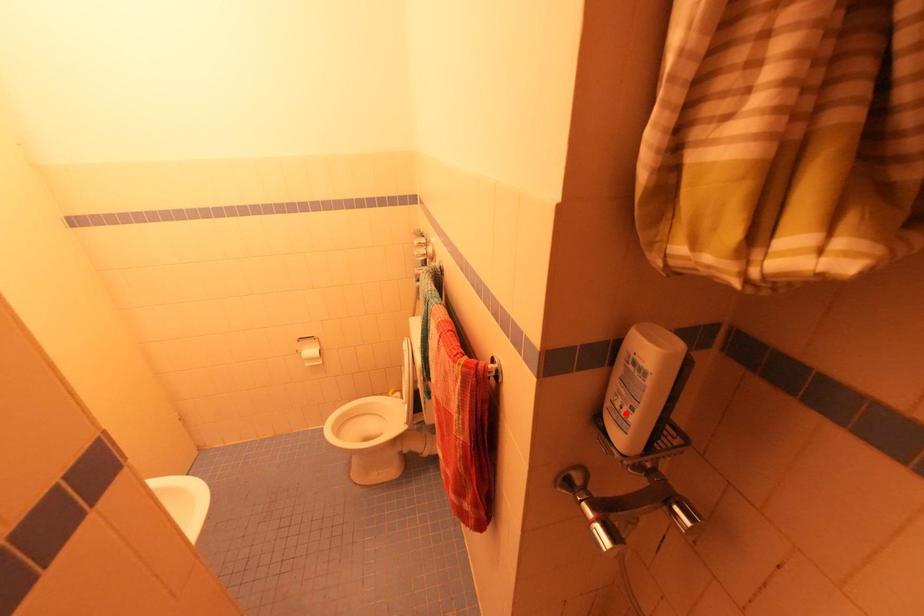
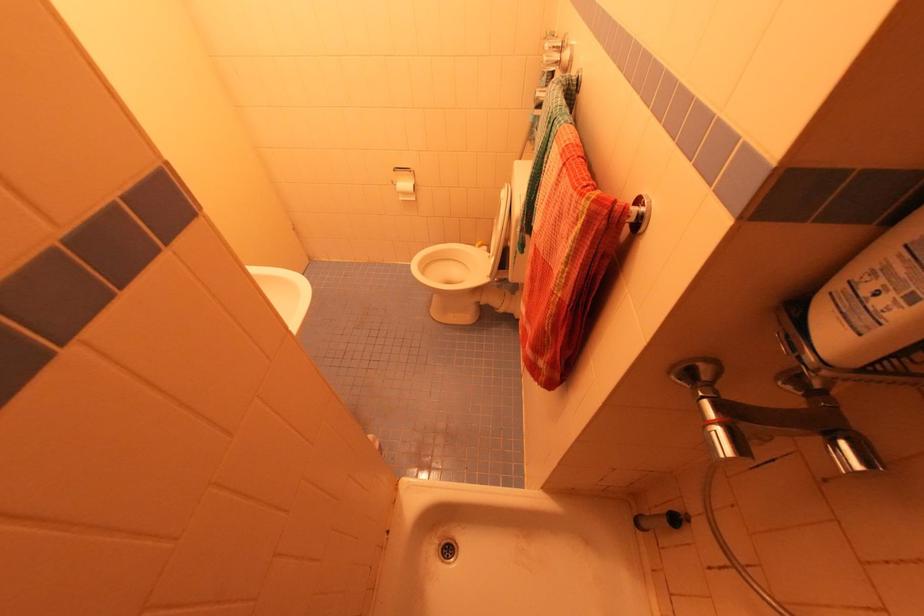
Question: I am providing you with two images of the same scene from different viewpoints. A red point is marked on the first image. Is the red point's position out of view in image 2?

Choices:
 (A) Yes
 (B) No

Answer: (B)